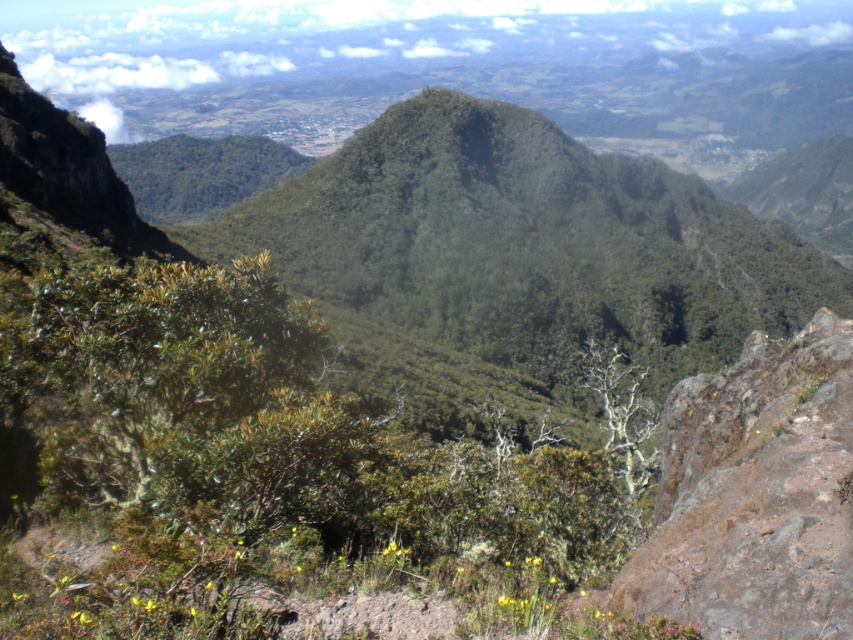
Question: Does green leafy shrub at center have a larger size compared to brown rough rock at right?

Choices:
 (A) yes
 (B) no

Answer: (A)

Question: In this image, where is green leafy shrub at center located relative to brown rough rock at right?

Choices:
 (A) right
 (B) left

Answer: (B)

Question: Is green leafy shrub at center behind brown rough rock at right?

Choices:
 (A) yes
 (B) no

Answer: (B)

Question: Which of the following is the closest to the observer?

Choices:
 (A) (111, 529)
 (B) (815, 429)

Answer: (B)